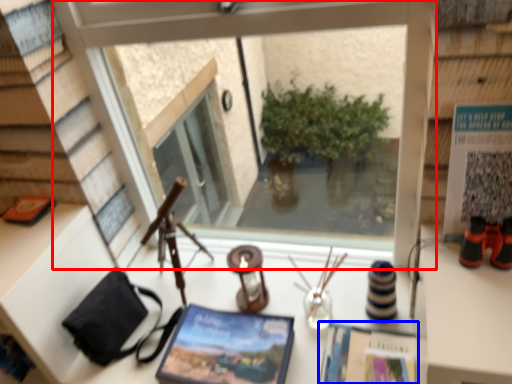
Question: Among these objects, which one is nearest to the camera, window (highlighted by a red box) or magazine (highlighted by a blue box)?

Choices:
 (A) window
 (B) magazine

Answer: (A)